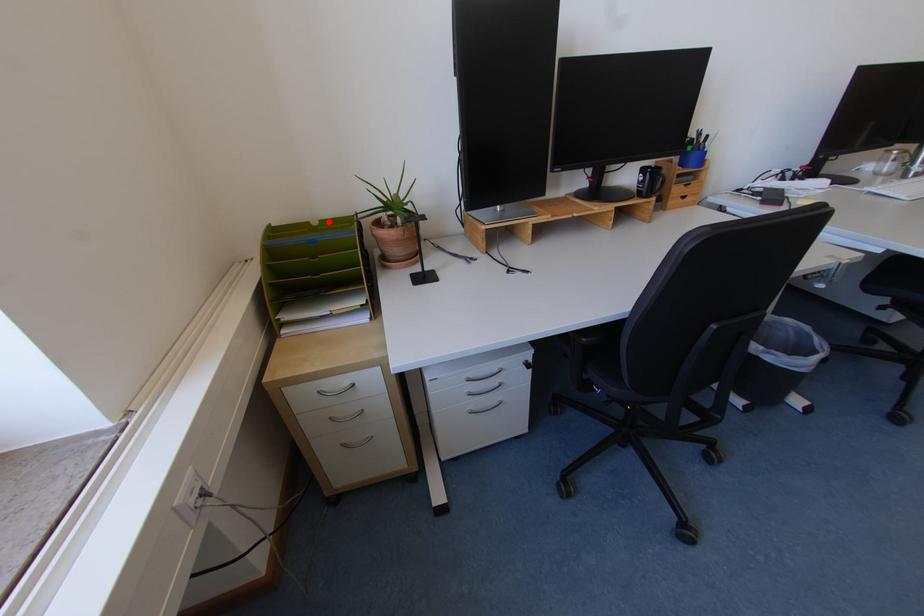
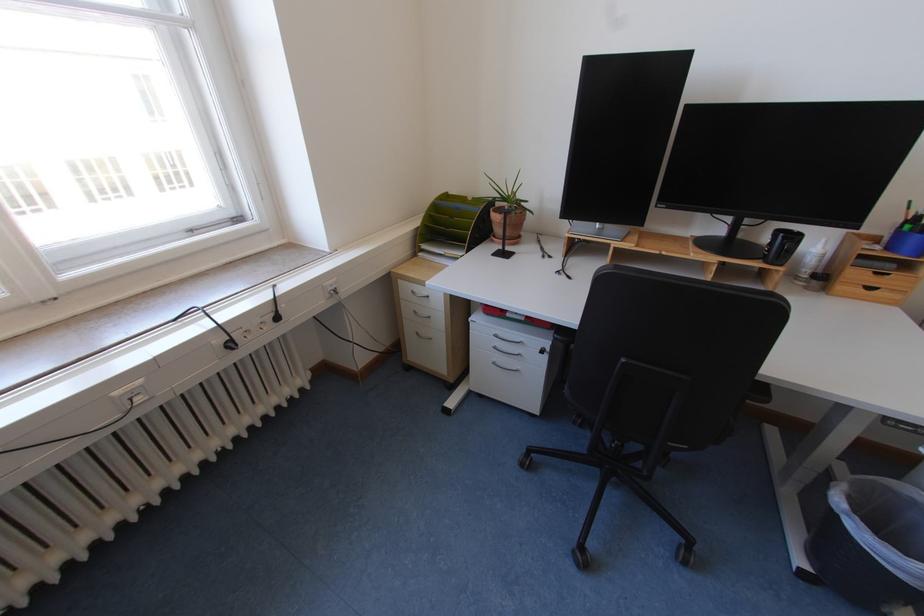
Locate, in the second image, the point that corresponds to the highlighted location in the first image.

(481, 199)